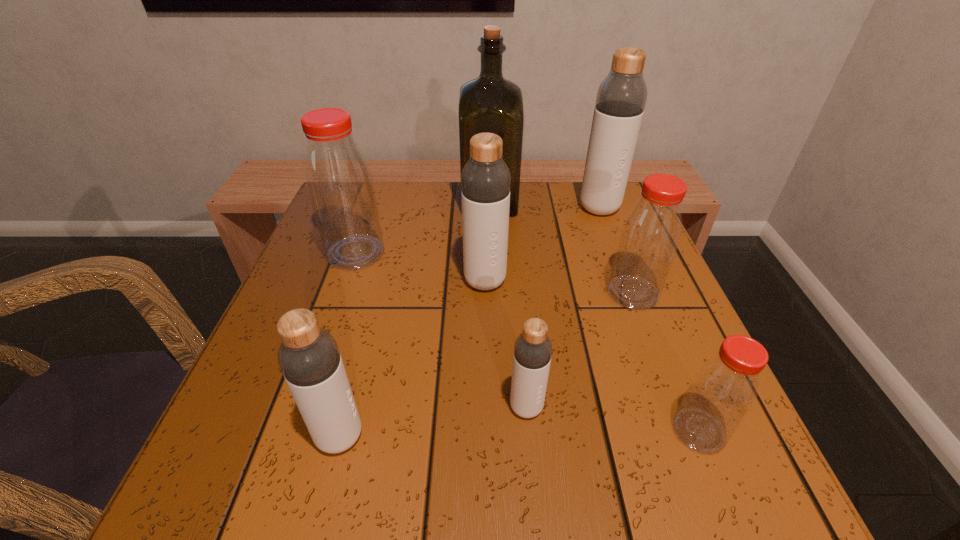
Find the location of a particular element. free space that satisfies the following two spatial constraints: 1. on the back side of the smallest gray bottle; 2. on the label of the liquor is located at coordinates (508, 201).